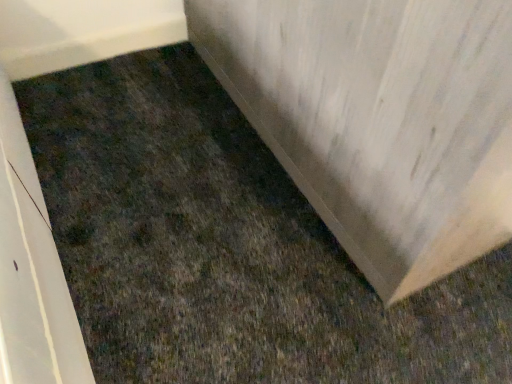
What do you see at coordinates (379, 120) in the screenshot? I see `wooden door at upper right` at bounding box center [379, 120].

In order to face wooden door at upper right, should I rotate leftwards or rightwards?

To align with it, rotate left about 4.514°.

Where is `wooden door at upper right`? wooden door at upper right is located at coordinates [x=379, y=120].

Identify the location of wooden door at upper right. 379,120.